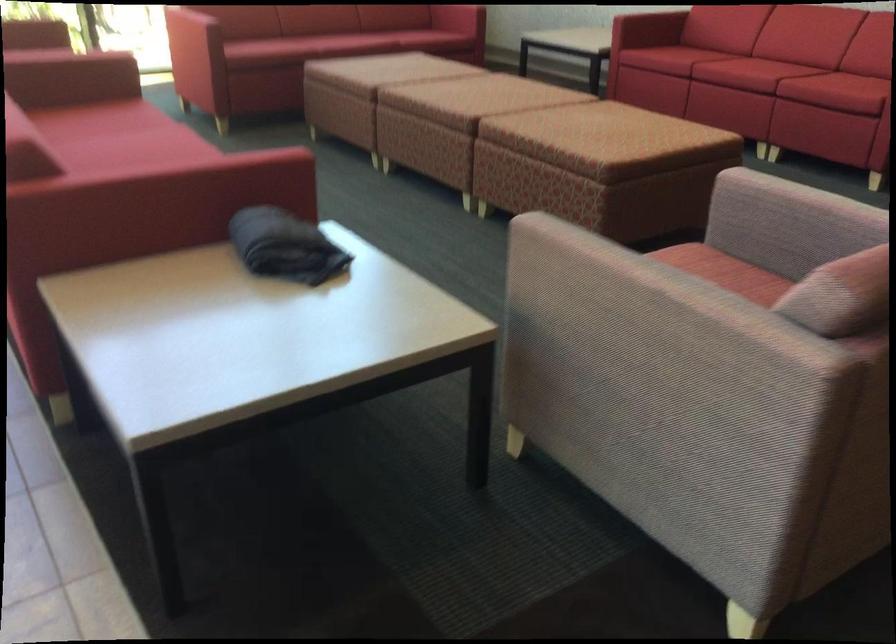
This screenshot has width=896, height=644. What do you see at coordinates (625, 328) in the screenshot?
I see `a striped chair armrest` at bounding box center [625, 328].